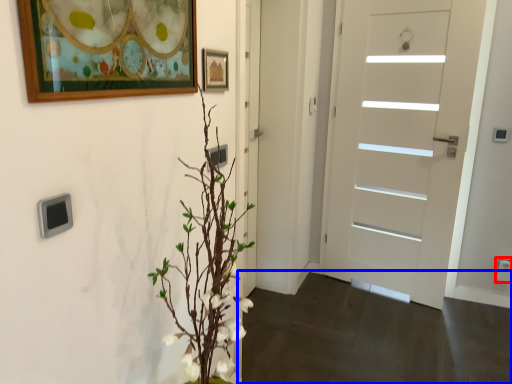
Question: Which of the following is the closest to the observer, electric outlet (highlighted by a red box) or corridor (highlighted by a blue box)?

Choices:
 (A) electric outlet
 (B) corridor

Answer: (B)